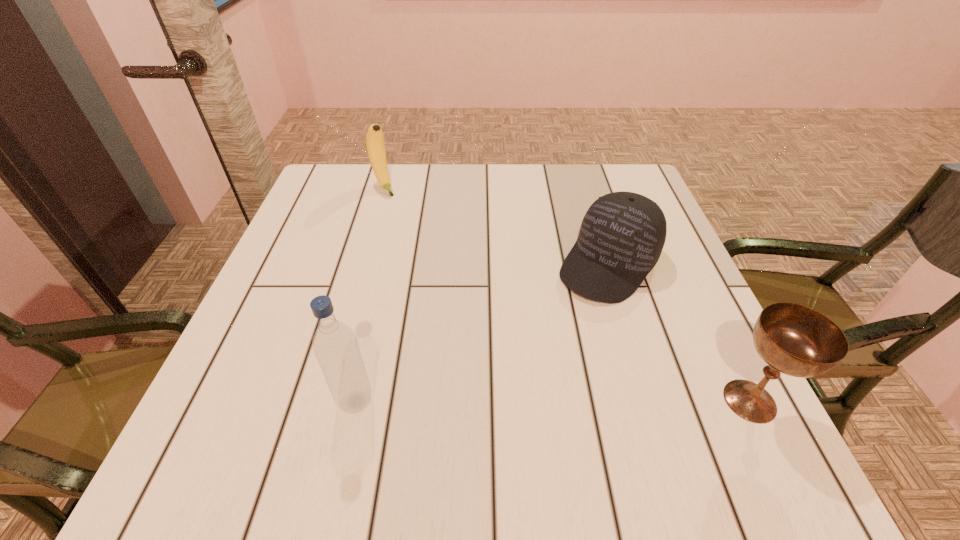
At what (x,y) coordinates should I click in order to perform the action: click on vacant space on the desktop that is between the water bottle and the chalice and is positioned at the front of the second farthest object where the brim is located. Please return your answer as a coordinate pair (x, y). The image size is (960, 540). Looking at the image, I should click on (494, 401).

Identify the location of free spot on the desktop that is between the tallest object and the chalice and is positioned from the stem of the farthest object. This screenshot has width=960, height=540. (535, 401).